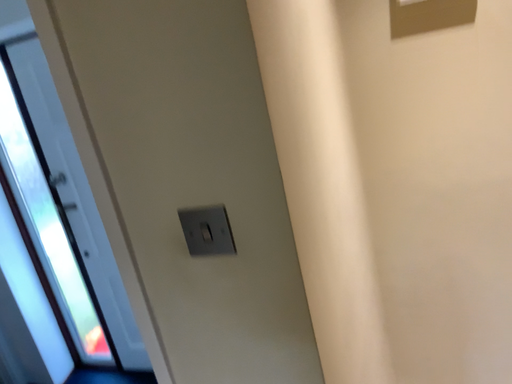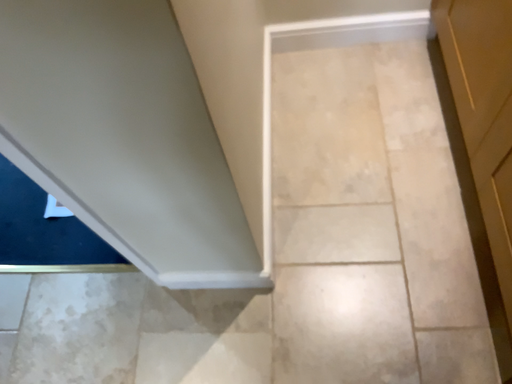
Question: Which way did the camera rotate in the video?

Choices:
 (A) rotated upward
 (B) rotated downward

Answer: (B)